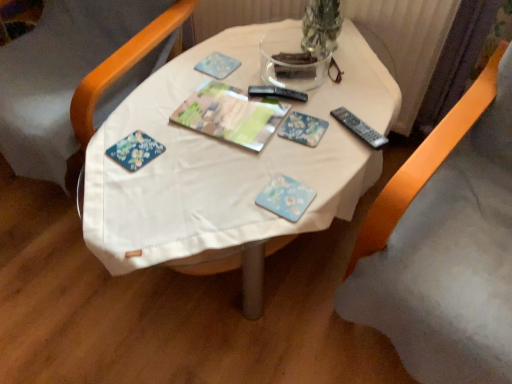
Identify the location of free space that is in between floral paper magazine at center and floral-patterned paper at center-left. This screenshot has width=512, height=384. (190, 148).